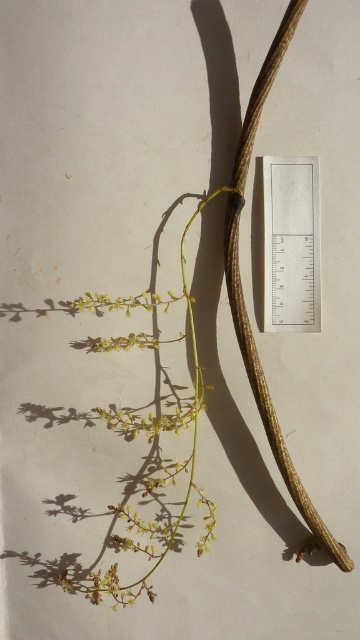
At what (x,y) coordinates should I click in order to perform the action: click on white paper ruler at upper center. Please return your answer as a coordinate pair (x, y). This screenshot has width=360, height=640. Looking at the image, I should click on (290, 244).

Looking at this image, does white paper ruler at upper center have a greater height compared to brown rough branch at center?

In fact, white paper ruler at upper center may be shorter than brown rough branch at center.

Is point (281, 163) closer to camera compared to point (297, 12)?

That is False.

Where is `white paper ruler at upper center`? The image size is (360, 640). white paper ruler at upper center is located at coordinates coord(290,244).